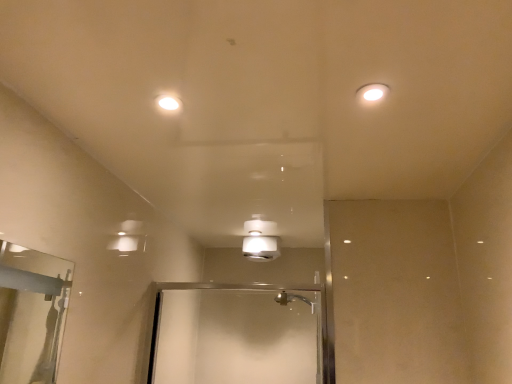
Question: In terms of size, does white glossy light fixture at upper right, the second light fixture in the bottom-to-top sequence, appear bigger or smaller than white glossy light fixture at center, which appears as the first light fixture when viewed from the back?

Choices:
 (A) small
 (B) big

Answer: (A)

Question: From the image's perspective, is white glossy light fixture at upper right, the 1th light fixture positioned from the front, positioned above or below white glossy light fixture at center, the first light fixture when ordered from left to right?

Choices:
 (A) below
 (B) above

Answer: (B)

Question: Is white glossy light fixture at upper right, which is the 1th light fixture in top-to-bottom order, in front of or behind white glossy light fixture at center, which is the 2th light fixture from top to bottom, in the image?

Choices:
 (A) front
 (B) behind

Answer: (A)

Question: In terms of width, does white glossy light fixture at center, the second light fixture from the right, look wider or thinner when compared to white glossy light fixture at upper right, the second light fixture in the bottom-to-top sequence?

Choices:
 (A) wide
 (B) thin

Answer: (A)

Question: In the image, is white glossy light fixture at center, the second light fixture from the right, on the left side or the right side of white glossy light fixture at upper right, arranged as the first light fixture when viewed from the right?

Choices:
 (A) right
 (B) left

Answer: (B)

Question: Is white glossy light fixture at center, which appears as the first light fixture when viewed from the back, bigger or smaller than white glossy light fixture at upper right, the 2th light fixture positioned from the left?

Choices:
 (A) big
 (B) small

Answer: (A)

Question: Is point (273, 236) positioned closer to the camera than point (375, 94)?

Choices:
 (A) farther
 (B) closer

Answer: (A)